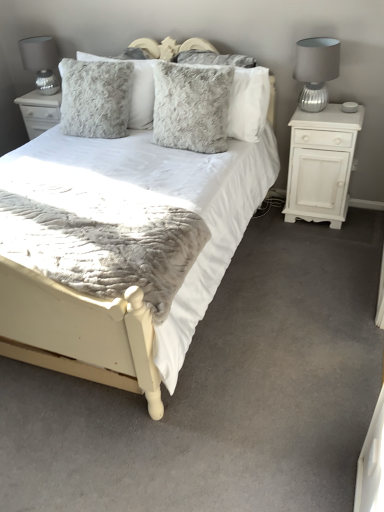
Question: Does white matte cabinet at right have a lesser width compared to fuzzy gray pillow at center, placed as the second pillow when sorted from right to left?

Choices:
 (A) yes
 (B) no

Answer: (B)

Question: From a real-world perspective, is white matte cabinet at right beneath fuzzy gray pillow at center, placed as the second pillow when sorted from right to left?

Choices:
 (A) no
 (B) yes

Answer: (B)

Question: Would you say white matte cabinet at right is outside fuzzy gray pillow at center, which ranks as the second pillow in left-to-right order?

Choices:
 (A) no
 (B) yes

Answer: (B)

Question: From the image's perspective, is white matte cabinet at right below fuzzy gray pillow at center, which ranks as the second pillow in left-to-right order?

Choices:
 (A) no
 (B) yes

Answer: (B)

Question: Is the depth of white matte cabinet at right less than that of fuzzy gray pillow at center, which ranks as the second pillow in left-to-right order?

Choices:
 (A) no
 (B) yes

Answer: (A)

Question: From a real-world perspective, is fuzzy gray pillow at center, the third pillow from the left, physically located above or below satin silver lampshade at upper left, marked as the first table lamp in a left-to-right arrangement?

Choices:
 (A) below
 (B) above

Answer: (A)

Question: From their relative heights in the image, would you say fuzzy gray pillow at center, the third pillow from the left, is taller or shorter than satin silver lampshade at upper left, the second table lamp positioned from the right?

Choices:
 (A) tall
 (B) short

Answer: (B)

Question: Considering the positions of fuzzy gray pillow at center, the first pillow in the right-to-left sequence, and satin silver lampshade at upper left, which is the second table lamp in front-to-back order, in the image, is fuzzy gray pillow at center, the first pillow in the right-to-left sequence, wider or thinner than satin silver lampshade at upper left, which is the second table lamp in front-to-back order,?

Choices:
 (A) thin
 (B) wide

Answer: (A)

Question: Based on their sizes in the image, would you say fuzzy gray pillow at center, the third pillow from the left, is bigger or smaller than satin silver lampshade at upper left, the second table lamp positioned from the right?

Choices:
 (A) big
 (B) small

Answer: (A)

Question: Based on their positions, is white matte cabinet at right located to the left or right of fuzzy gray pillow at center, the third pillow from the left?

Choices:
 (A) right
 (B) left

Answer: (A)

Question: From a real-world perspective, is white matte cabinet at right positioned above or below fuzzy gray pillow at center, the third pillow from the left?

Choices:
 (A) above
 (B) below

Answer: (B)

Question: From the image's perspective, is white matte cabinet at right above or below fuzzy gray pillow at center, the third pillow from the left?

Choices:
 (A) above
 (B) below

Answer: (B)

Question: In terms of width, does white matte cabinet at right look wider or thinner when compared to fuzzy gray pillow at center, the first pillow in the right-to-left sequence?

Choices:
 (A) thin
 (B) wide

Answer: (B)

Question: Does point (193, 121) appear closer or farther from the camera than point (31, 40)?

Choices:
 (A) closer
 (B) farther

Answer: (A)

Question: Is fuzzy gray pillow at center, which ranks as the second pillow in left-to-right order, wider or thinner than satin silver lampshade at upper left, positioned as the first table lamp in back-to-front order?

Choices:
 (A) wide
 (B) thin

Answer: (B)